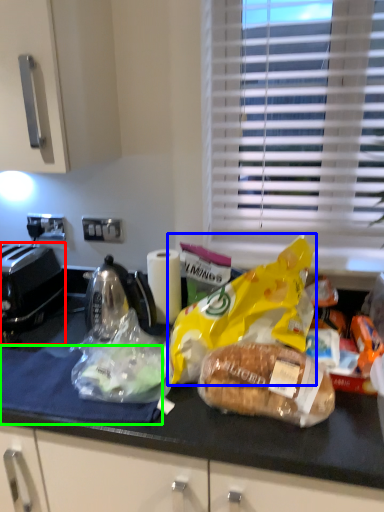
Question: Estimate the real-world distances between objects in this image. Which object is farther from toaster (highlighted by a red box), plastic bag (highlighted by a blue box) or cloth (highlighted by a green box)?

Choices:
 (A) plastic bag
 (B) cloth

Answer: (A)